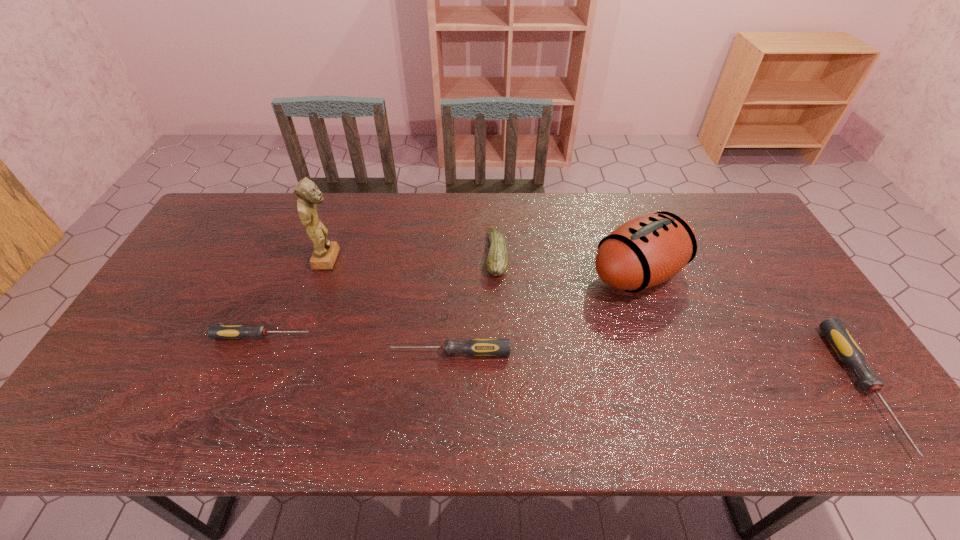
This screenshot has height=540, width=960. I want to click on free point located insert the fifth tallest object into a screw head, so click(351, 352).

I want to click on blank space located 0.130m insert the fifth tallest object into a screw head, so click(x=340, y=352).

You are a GUI agent. You are given a task and a screenshot of the screen. Output one action in this format:
    pyautogui.click(x=<x>, y=<y>)
    Task: Click on the vacant point located 0.160m insert the fifth tallest object into a screw head
    This screenshot has width=960, height=540.
    Given the screenshot: What is the action you would take?
    pyautogui.click(x=328, y=352)

The image size is (960, 540). Find the location of `vacant space located on the back of the second tallest object`. vacant space located on the back of the second tallest object is located at coordinates (622, 227).

I want to click on vacant space situated at the stem end of the zucchini, so click(435, 254).

Where is `vacant space located at the stem end of the zucchini`? Image resolution: width=960 pixels, height=540 pixels. vacant space located at the stem end of the zucchini is located at coordinates (457, 254).

The width and height of the screenshot is (960, 540). What are the coordinates of `vacant space located at the stem end of the zucchini` in the screenshot? It's located at (431, 254).

Where is `vacant region located on the front-facing side of the figurine`? The width and height of the screenshot is (960, 540). vacant region located on the front-facing side of the figurine is located at coordinates [432, 259].

This screenshot has width=960, height=540. In order to click on object that is at the far edge in this screenshot , I will do `click(497, 261)`.

Where is `object that is at the near edge`? The image size is (960, 540). object that is at the near edge is located at coordinates (845, 346).